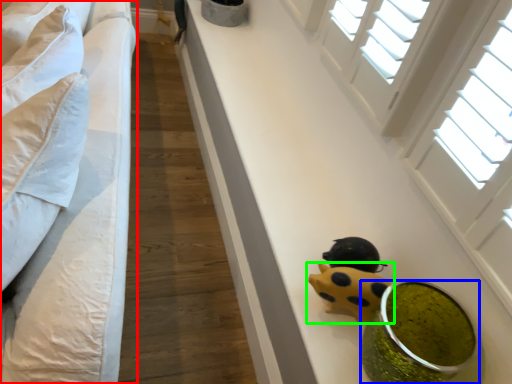
Question: Which is farther away from furniture (highlighted by a red box)? food (highlighted by a blue box) or toy (highlighted by a green box)?

Choices:
 (A) food
 (B) toy

Answer: (A)